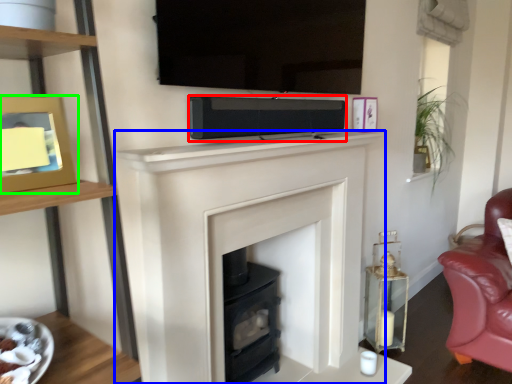
Question: Considering the real-world distances, which object is closest to stereo (highlighted by a red box)? fireplace (highlighted by a blue box) or picture frame (highlighted by a green box).

Choices:
 (A) fireplace
 (B) picture frame

Answer: (A)